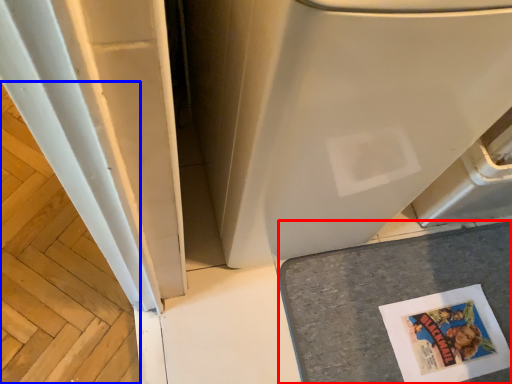
Question: Which point is closer to the camera, counter top (highlighted by a red box) or wood (highlighted by a blue box)?

Choices:
 (A) counter top
 (B) wood

Answer: (A)